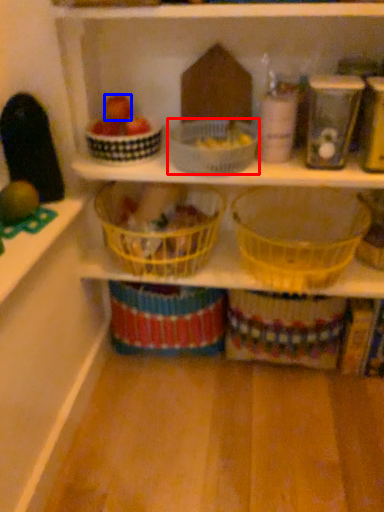
Question: Which object appears farthest to the camera in this image, basket (highlighted by a red box) or apple (highlighted by a blue box)?

Choices:
 (A) basket
 (B) apple

Answer: (B)